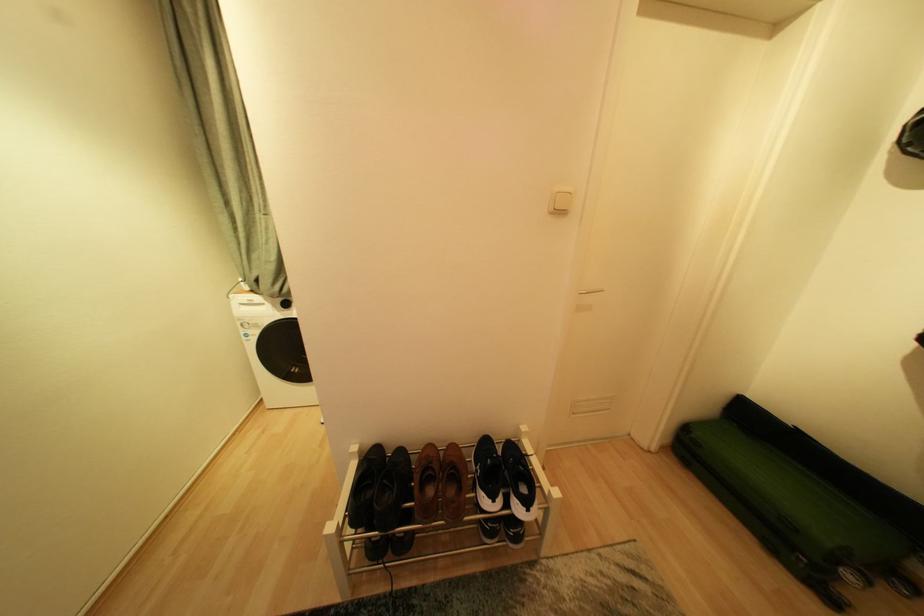
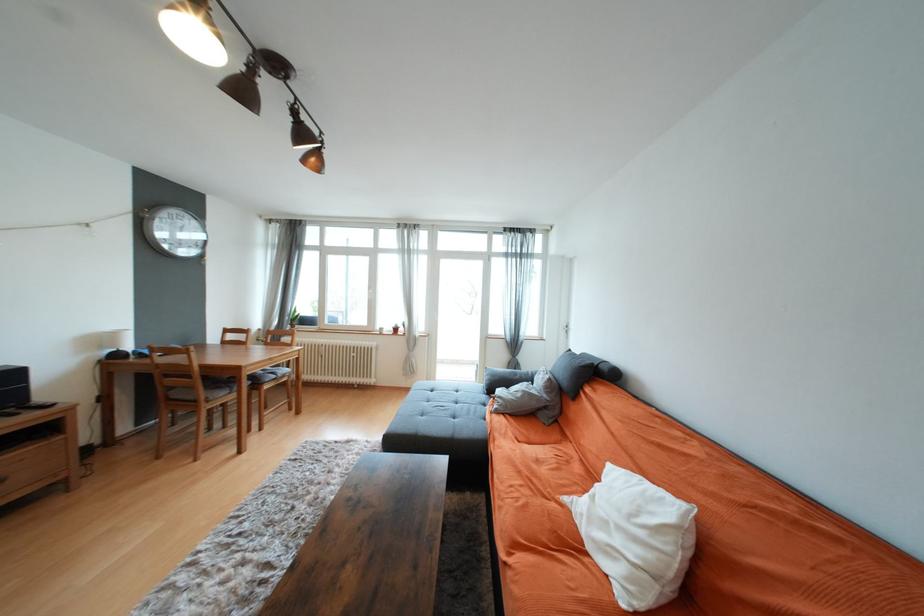
Question: In a continuous first-person perspective shot, in which direction is the camera moving?

Choices:
 (A) Left
 (B) Right
 (C) Forward
 (D) Backward

Answer: (A)